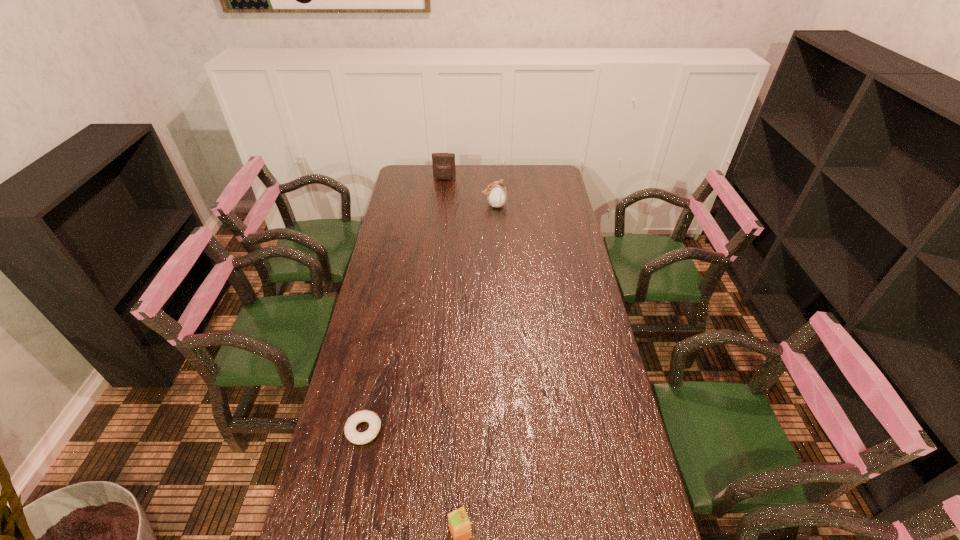
Identify the location of the left pouch. (443, 163).

Find the location of `the farther pouch`. the farther pouch is located at coordinates (443, 163).

Locate an element on the screen. the right pouch is located at coordinates (496, 192).

Where is `the second farthest object`? the second farthest object is located at coordinates (496, 192).

Where is `the leftmost object`? Image resolution: width=960 pixels, height=540 pixels. the leftmost object is located at coordinates (351, 433).

In order to click on doughnut in this screenshot , I will do `click(351, 433)`.

This screenshot has width=960, height=540. I want to click on vacant space located with an open flap on the left pouch, so tap(444, 187).

Where is `vacant space located on the front-facing side of the third nearest object`? This screenshot has width=960, height=540. vacant space located on the front-facing side of the third nearest object is located at coordinates (420, 205).

You are a GUI agent. You are given a task and a screenshot of the screen. Output one action in this format:
    pyautogui.click(x=<x>, y=<y>)
    Task: Click on the vacant point located on the front-facing side of the third nearest object
    This screenshot has width=960, height=540.
    Given the screenshot: What is the action you would take?
    pyautogui.click(x=465, y=205)

The image size is (960, 540). Identify the location of vacant space positioned 0.220m on the front-facing side of the third nearest object. (436, 205).